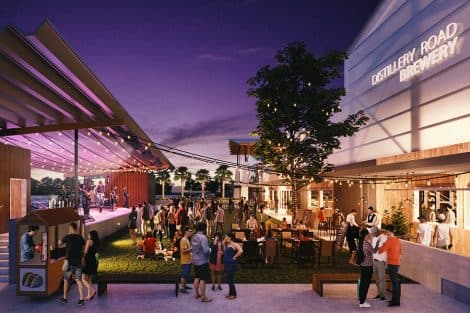
The width and height of the screenshot is (470, 313). Identify the location of lights. (143, 150), (105, 150).